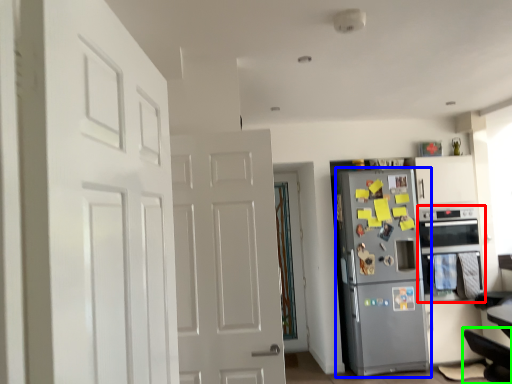
Question: Which object is the farthest from oven (highlighted by a red box)? Choose among these: refrigerator (highlighted by a blue box) or swivel chair (highlighted by a green box).

Choices:
 (A) refrigerator
 (B) swivel chair

Answer: (B)